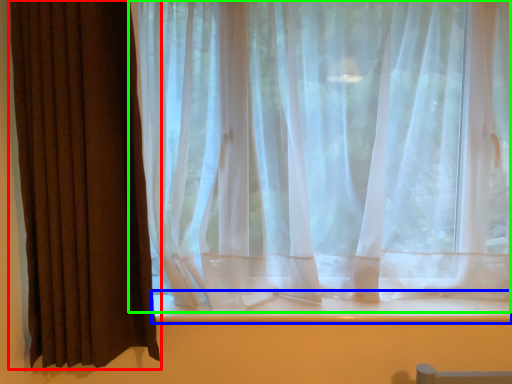
Question: Considering the real-world distances, which object is closest to curtain (highlighted by a red box)? window sill (highlighted by a blue box) or curtain (highlighted by a green box).

Choices:
 (A) window sill
 (B) curtain

Answer: (B)